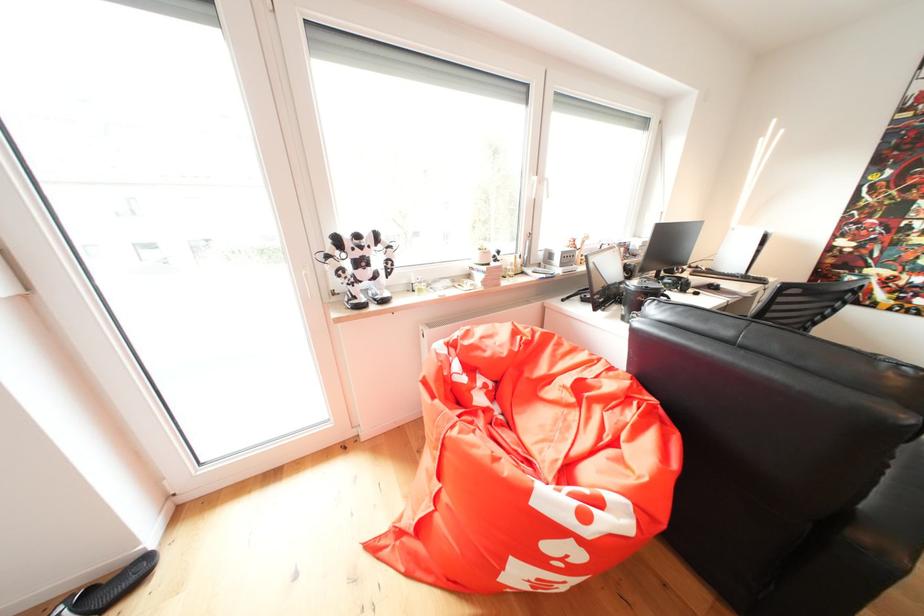
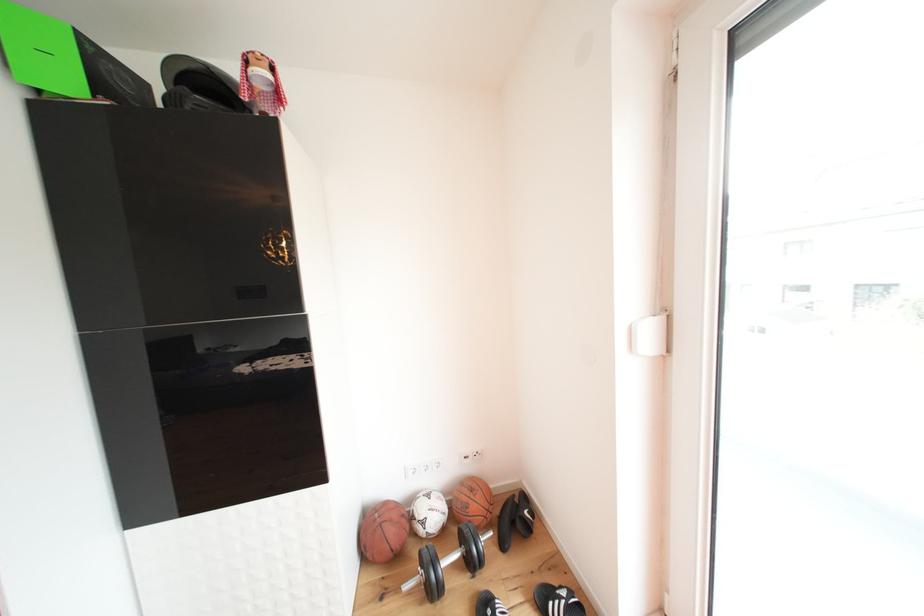
Question: Based on the continuous images, in which direction is the camera rotating? Reply with the corresponding letter.

Choices:
 (A) Left
 (B) Right
 (C) Up
 (D) Down

Answer: (A)